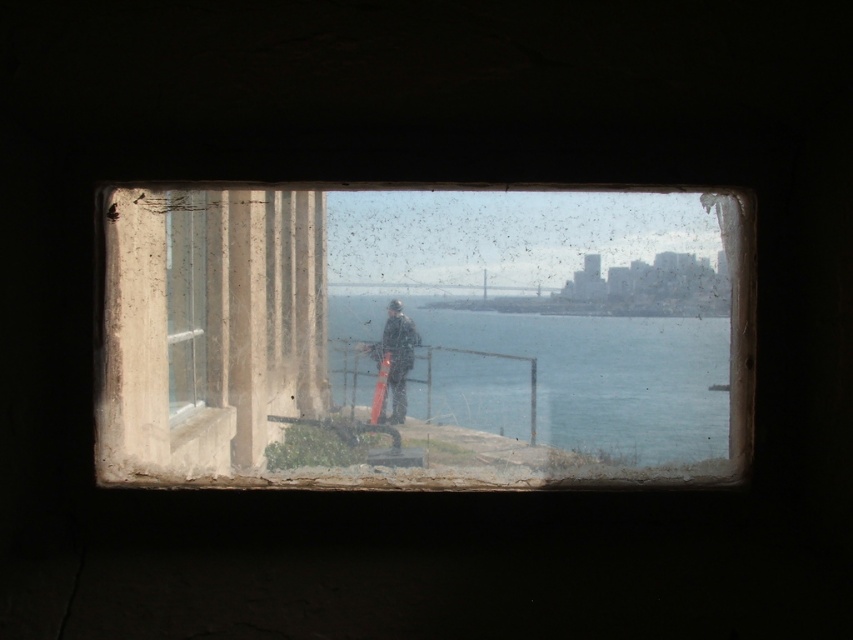
You are standing in a room with a small vintage window. You see a dark gray fabric jacket at center and clear blue water at center through the window. Which object is positioned to the right of the other?

The clear blue water at center is to the right of the dark gray fabric jacket at center.

You are standing in a room with a matte glass window at center and clear blue water at center visible outside. If you want to touch the window or the water, which one can you physically reach?

The matte glass window at center is closer to the viewer than the clear blue water at center, so you can physically reach the matte glass window at center.

You are standing in a room and want to clean the matte glass window at center. If your arm can reach up to 4 feet, can you reach the window without moving closer?

The matte glass window at center is 4.63 feet away from the camera, which is beyond your arm reach of 4 feet. You need to move closer to reach it.